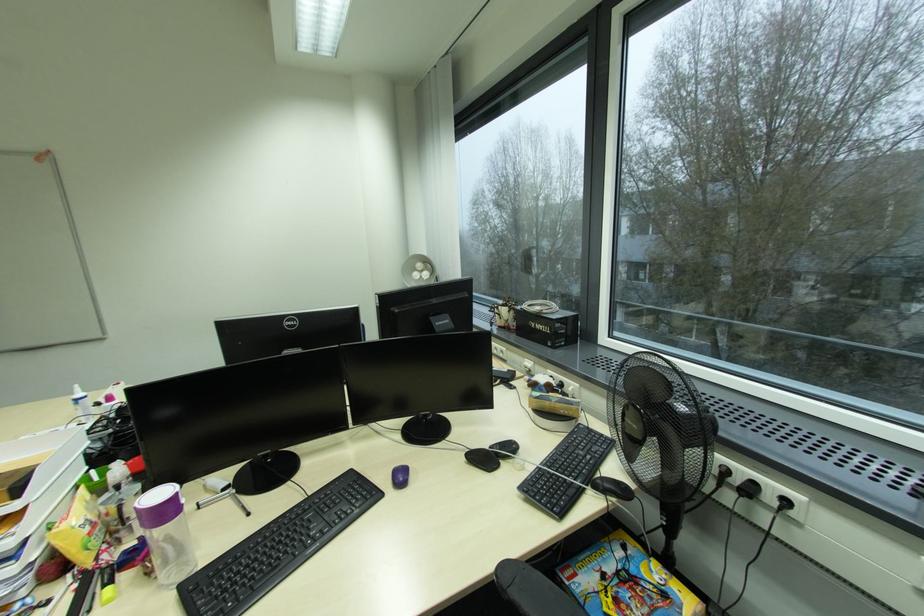
Image resolution: width=924 pixels, height=616 pixels. Describe the element at coordinates (156, 499) in the screenshot. I see `the purple container lid` at that location.